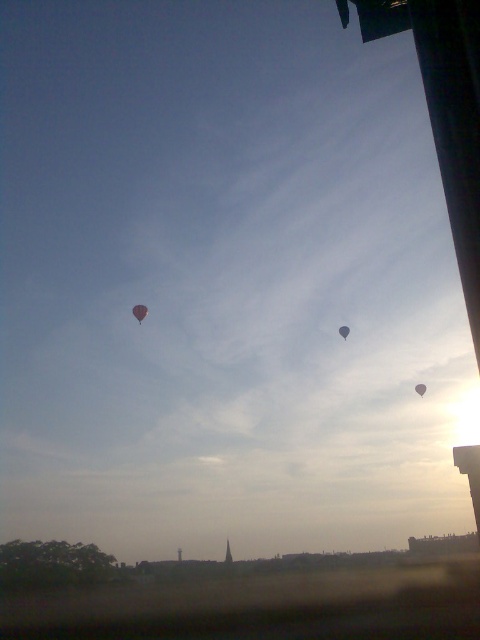
Question: Based on their relative distances, which object is nearer to the matte pink balloon at upper center?

Choices:
 (A) matte gray balloon at center
 (B) gray matte balloon at upper center

Answer: (A)

Question: Can you confirm if gray matte balloon at upper center is positioned to the right of matte gray balloon at center?

Choices:
 (A) no
 (B) yes

Answer: (B)

Question: Can you confirm if matte pink balloon at upper center is positioned below matte gray balloon at center?

Choices:
 (A) no
 (B) yes

Answer: (A)

Question: Which point appears closest to the camera in this image?

Choices:
 (A) (346, 337)
 (B) (424, 388)
 (C) (139, 307)

Answer: (A)

Question: Is gray matte balloon at upper center positioned behind matte gray balloon at center?

Choices:
 (A) no
 (B) yes

Answer: (B)

Question: Which object appears farthest from the camera in this image?

Choices:
 (A) gray matte balloon at upper center
 (B) matte gray balloon at center

Answer: (A)